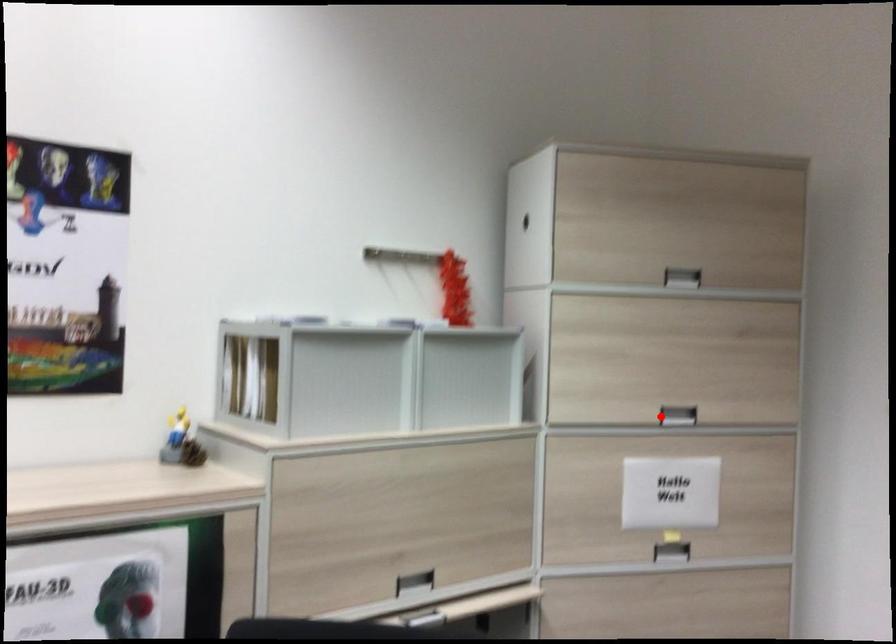
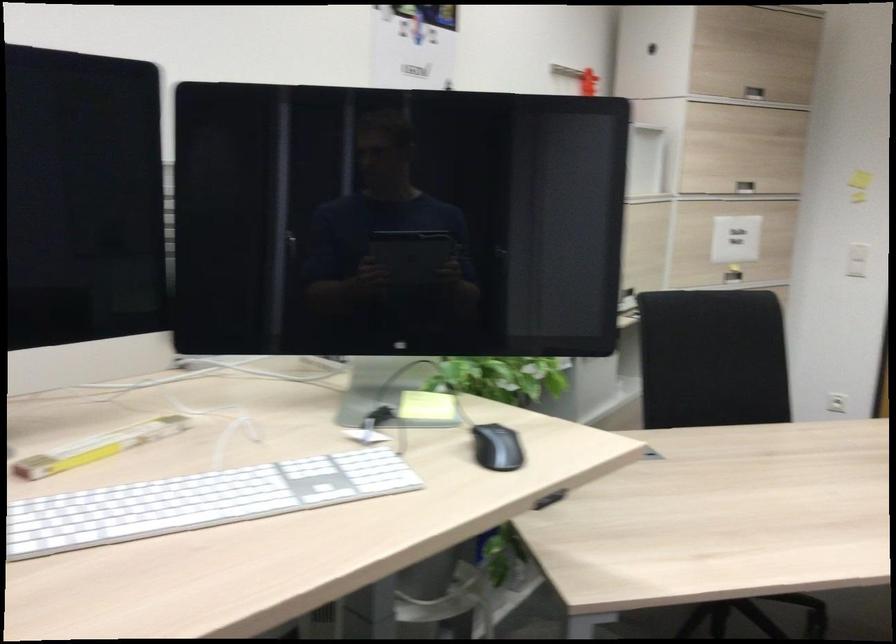
Question: I am providing you with two images of the same scene from different viewpoints. A red point is shown in image1. For the corresponding object point in image2, is it positioned nearer or farther from the camera?

Choices:
 (A) Nearer
 (B) Farther

Answer: (B)